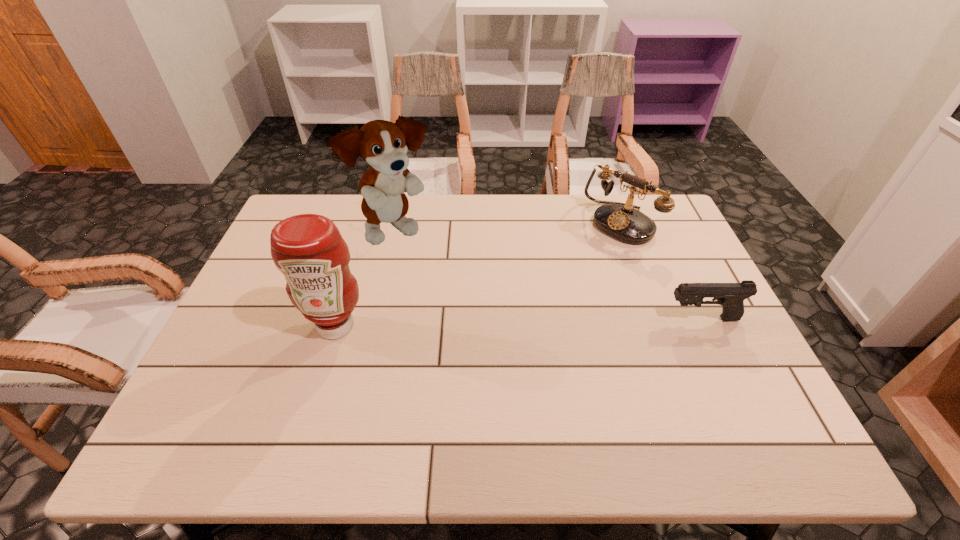
At what (x,y) coordinates should I click in order to perform the action: click on the third shortest object. Please return your answer as a coordinate pair (x, y). This screenshot has width=960, height=540. Looking at the image, I should click on (308, 249).

This screenshot has width=960, height=540. What are the coordinates of `pistol` in the screenshot? It's located at (731, 296).

This screenshot has height=540, width=960. Find the location of `puppy`. puppy is located at coordinates (382, 144).

Find the location of a particular element. telephone is located at coordinates (621, 221).

At what (x,y) coordinates should I click in order to perform the action: click on free space located on the left of the condiment. Please return your answer as a coordinate pair (x, y). Looking at the image, I should click on (252, 326).

At what (x,y) coordinates should I click in order to perform the action: click on vacant region located 0.120m at the barrel of the shortest object. Please return your answer as a coordinate pair (x, y). This screenshot has width=960, height=540. Looking at the image, I should click on (619, 319).

You are a GUI agent. You are given a task and a screenshot of the screen. Output one action in this format:
    pyautogui.click(x=<x>, y=<y>)
    Task: Click on the vacant space located 0.210m at the barrel of the shortest object
    The width and height of the screenshot is (960, 540).
    Given the screenshot: What is the action you would take?
    pyautogui.click(x=585, y=319)

Image resolution: width=960 pixels, height=540 pixels. What are the coordinates of `free space located at the barrel of the shortest object` in the screenshot? It's located at (596, 319).

This screenshot has width=960, height=540. Find the location of `vacant space located on the face of the puppy`. vacant space located on the face of the puppy is located at coordinates (458, 275).

Locate an element on the screen. Image resolution: width=960 pixels, height=540 pixels. vacant space located 0.280m on the face of the puppy is located at coordinates (488, 296).